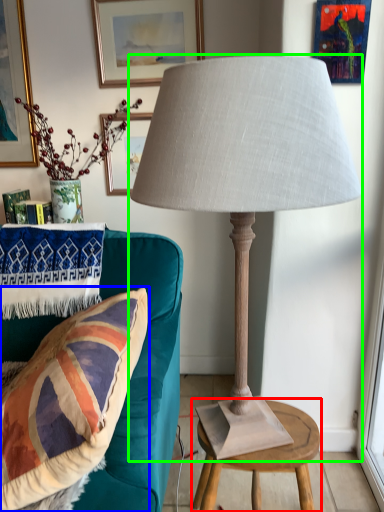
Question: Estimate the real-world distances between objects in this image. Which object is closer to table (highlighted by a red box), pillow (highlighted by a blue box) or lamp (highlighted by a green box)?

Choices:
 (A) pillow
 (B) lamp

Answer: (A)